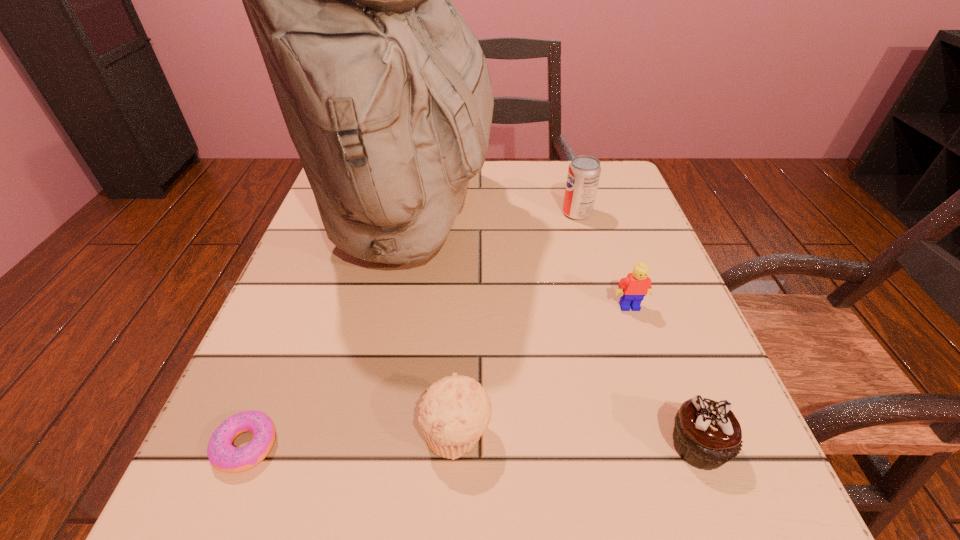
Locate an element on the screen. free space located on the left of the cupcake is located at coordinates (623, 446).

I want to click on free spot located 0.320m on the right of the doughnut, so (517, 446).

Locate an element on the screen. The width and height of the screenshot is (960, 540). backpack located at the far edge is located at coordinates (385, 91).

Locate an element on the screen. This screenshot has width=960, height=540. soda located at the far edge is located at coordinates tap(584, 171).

Identify the location of muffin that is at the near edge. (455, 412).

Locate an element on the screen. cupcake located in the near edge section of the desktop is located at coordinates (707, 434).

The height and width of the screenshot is (540, 960). Find the location of `doughnut that is at the near edge`. doughnut that is at the near edge is located at coordinates (226, 458).

At what (x,y) coordinates should I click in order to perform the action: click on backpack that is positioned at the left edge. Please return your answer as a coordinate pair (x, y). This screenshot has height=540, width=960. Looking at the image, I should click on (385, 91).

I want to click on doughnut positioned at the left edge, so click(x=226, y=458).

Locate an element on the screen. The image size is (960, 540). soda located at the right edge is located at coordinates (584, 171).